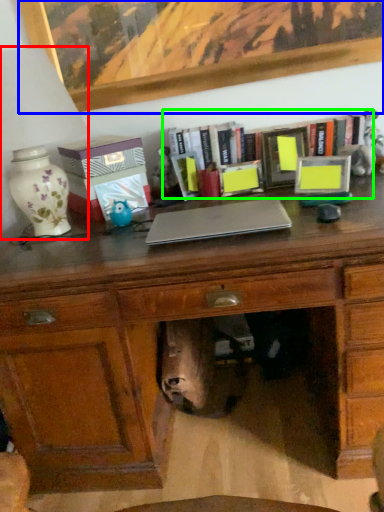
Question: Based on their relative distances, which object is farther from table lamp (highlighted by a red box)? Choose from picture frame (highlighted by a blue box) and bookcase (highlighted by a green box).

Choices:
 (A) picture frame
 (B) bookcase

Answer: (B)